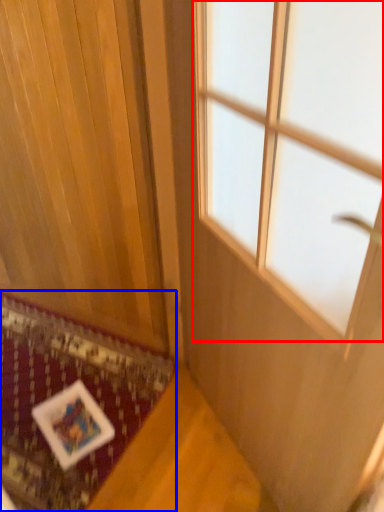
Question: Which object is further to the camera taking this photo, window (highlighted by a red box) or mat (highlighted by a blue box)?

Choices:
 (A) window
 (B) mat

Answer: (B)